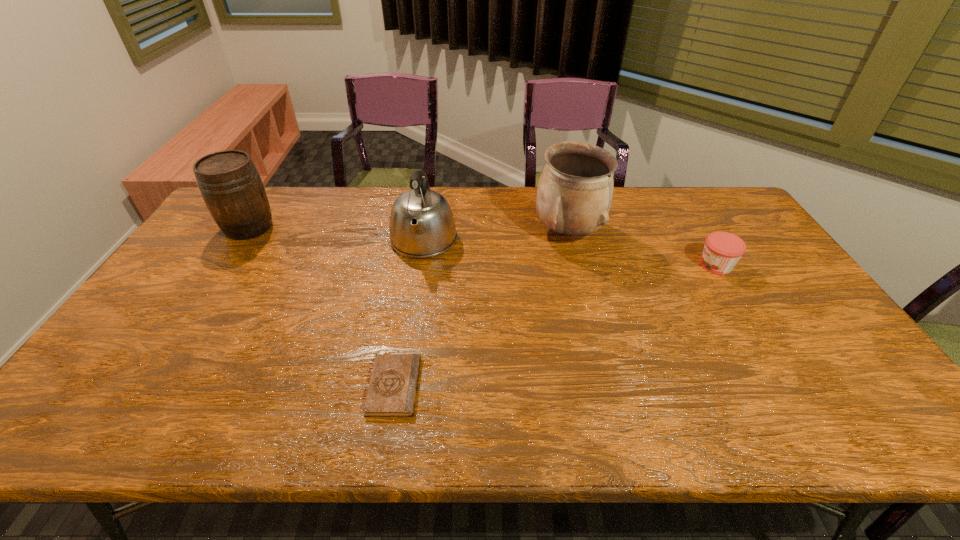
Locate an element on the screen. The height and width of the screenshot is (540, 960). urn is located at coordinates (575, 190).

Identify the location of kettle. The image size is (960, 540). (422, 225).

I want to click on cider, so click(230, 185).

The image size is (960, 540). I want to click on jam, so click(722, 250).

Where is `the rightmost object`? the rightmost object is located at coordinates (722, 250).

Where is `the nearest object`? The width and height of the screenshot is (960, 540). the nearest object is located at coordinates (x=392, y=391).

The width and height of the screenshot is (960, 540). I want to click on diary, so click(392, 391).

I want to click on vacant region located on the front of the urn, so click(580, 280).

At what (x,y) coordinates should I click in order to perform the action: click on vacant area situated 0.070m on the spout of the kettle. Please return your answer as a coordinate pair (x, y). This screenshot has width=960, height=540. Looking at the image, I should click on (417, 285).

You are a GUI agent. You are given a task and a screenshot of the screen. Output one action in this format:
    pyautogui.click(x=<x>, y=<y>)
    Task: Click on the vacant space positioned 0.070m on the side of the cider near the bung hole
    The width and height of the screenshot is (960, 540).
    Given the screenshot: What is the action you would take?
    pyautogui.click(x=297, y=227)